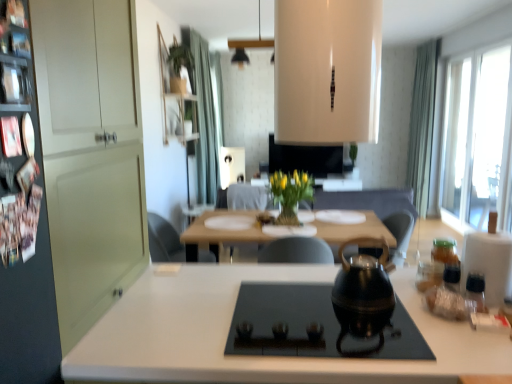
Locate an element on the screen. vacant space situated on the left part of black matte tea pot at center is located at coordinates (300, 302).